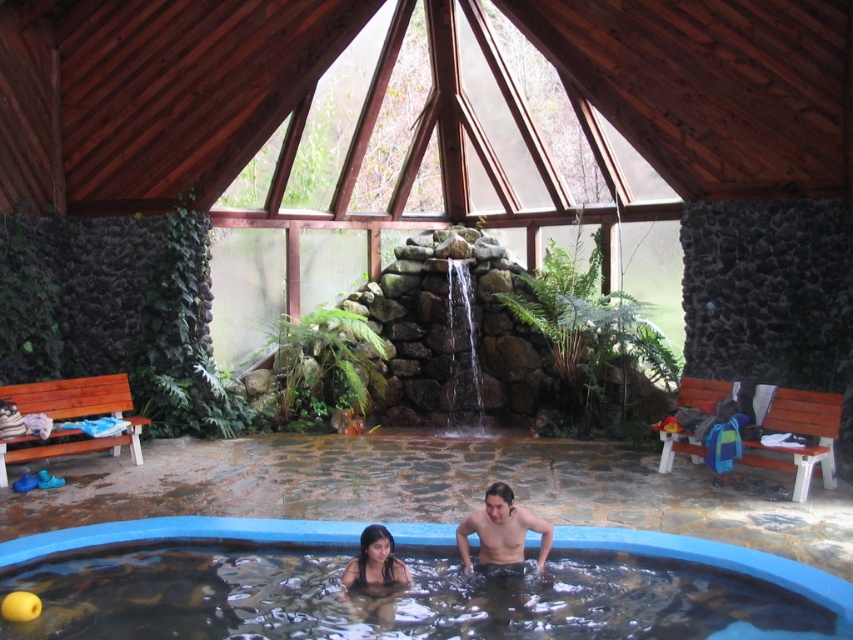
Question: Which point is closer to the camera?

Choices:
 (A) (512, 502)
 (B) (384, 573)
 (C) (167, 586)

Answer: (B)

Question: Which of the following is the closest to the observer?

Choices:
 (A) smooth black hair at lower center
 (B) smooth skin man at center

Answer: (A)

Question: Estimate the real-world distances between objects in this image. Which object is farther from the blue smooth pool at center?

Choices:
 (A) smooth skin man at center
 (B) smooth black hair at lower center

Answer: (A)

Question: Is smooth skin man at center positioned at the back of smooth black hair at lower center?

Choices:
 (A) no
 (B) yes

Answer: (B)

Question: Does blue smooth pool at center appear on the right side of smooth skin man at center?

Choices:
 (A) yes
 (B) no

Answer: (B)

Question: Does blue smooth pool at center appear on the right side of smooth skin man at center?

Choices:
 (A) no
 (B) yes

Answer: (A)